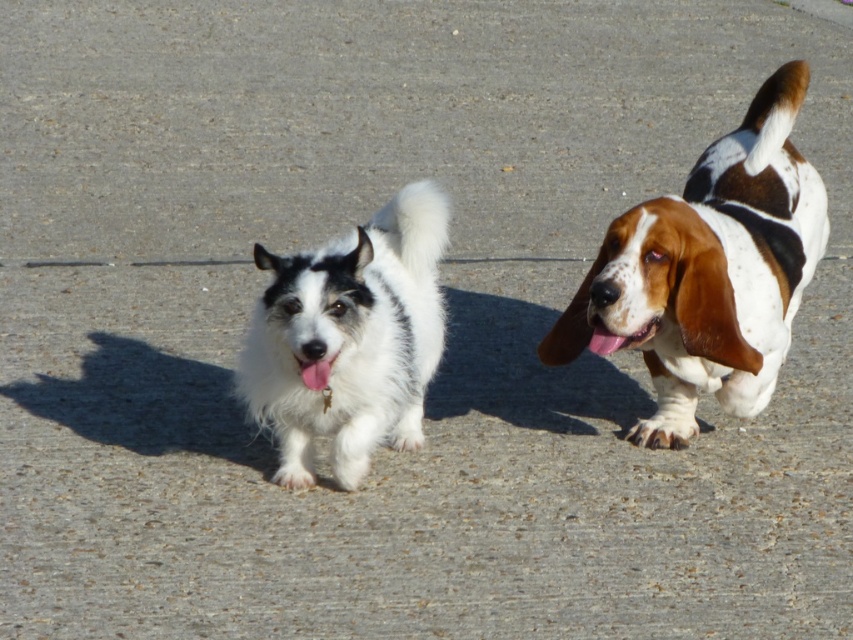
Question: Which object is the farthest from the brown and white fur dog at right?

Choices:
 (A) white fluffy dog at center
 (B) white fur tongue at center

Answer: (B)

Question: Based on their relative distances, which object is farther from the white fur tongue at center?

Choices:
 (A) brown and white fur dog at right
 (B) white fluffy dog at center

Answer: (A)

Question: Which object is positioned closest to the brown and white fur dog at right?

Choices:
 (A) white fluffy dog at center
 (B) white fur tongue at center

Answer: (A)

Question: Is brown and white fur dog at right thinner than white fluffy dog at center?

Choices:
 (A) yes
 (B) no

Answer: (B)

Question: Is brown and white fur dog at right to the left of white fur tongue at center from the viewer's perspective?

Choices:
 (A) no
 (B) yes

Answer: (A)

Question: Is white fluffy dog at center to the left of white fur tongue at center from the viewer's perspective?

Choices:
 (A) no
 (B) yes

Answer: (A)